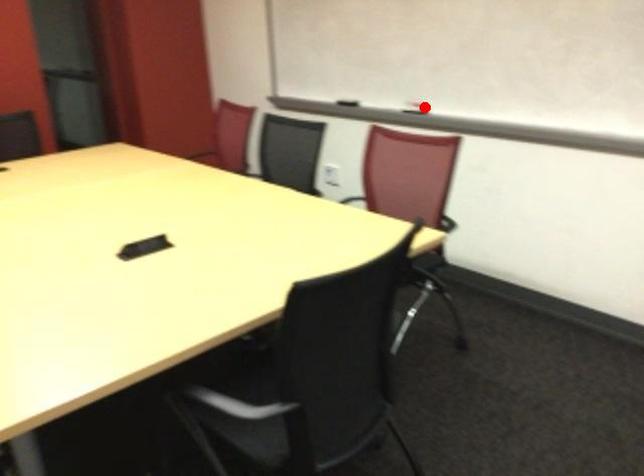
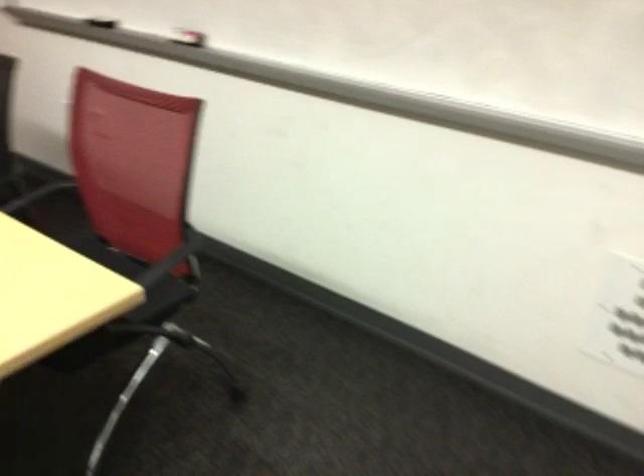
Question: I am providing you with two images of the same scene from different viewpoints. A red point is shown in image1. For the corresponding object point in image2, is it positioned nearer or farther from the camera?

Choices:
 (A) Nearer
 (B) Farther

Answer: (A)